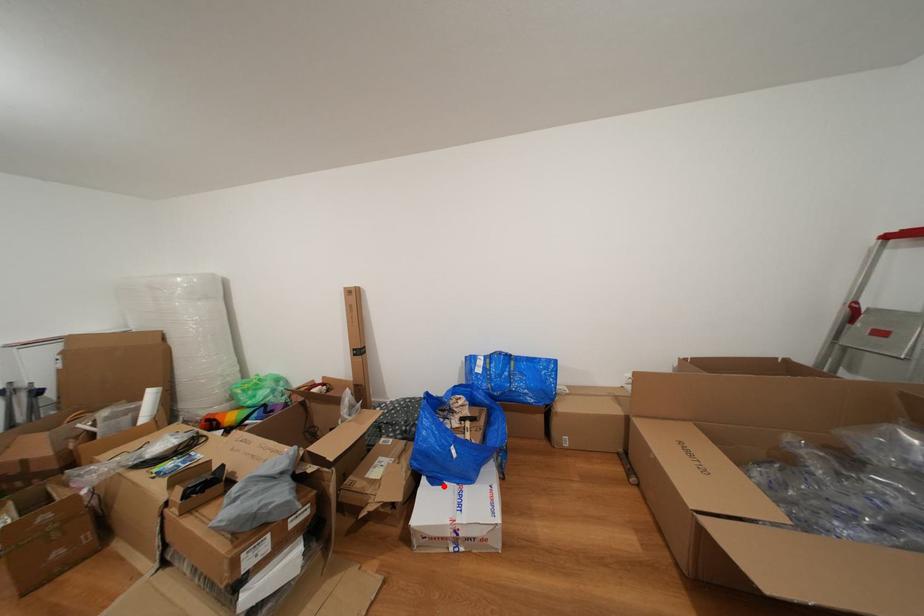
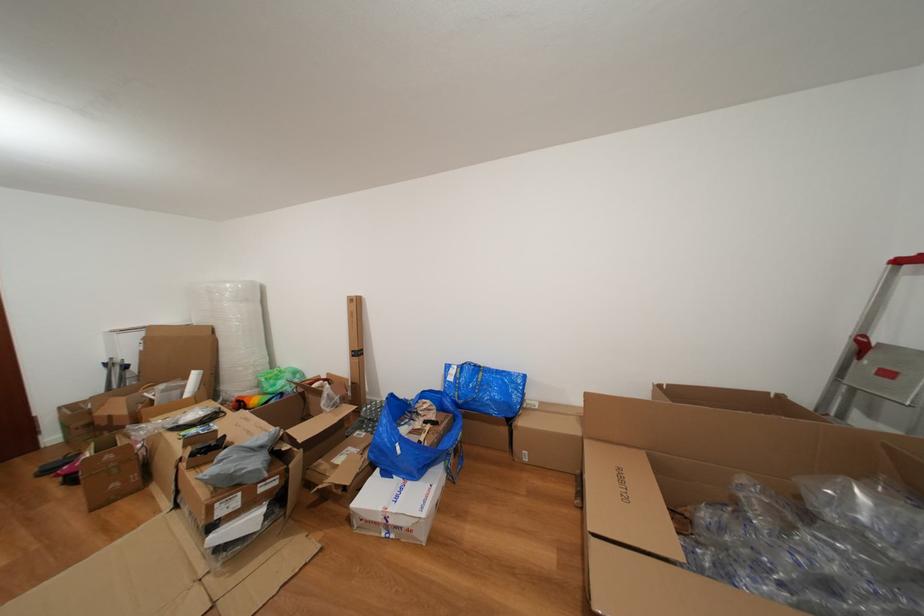
Find the pixel in the second image that matches the highlighted location in the first image.

(394, 479)